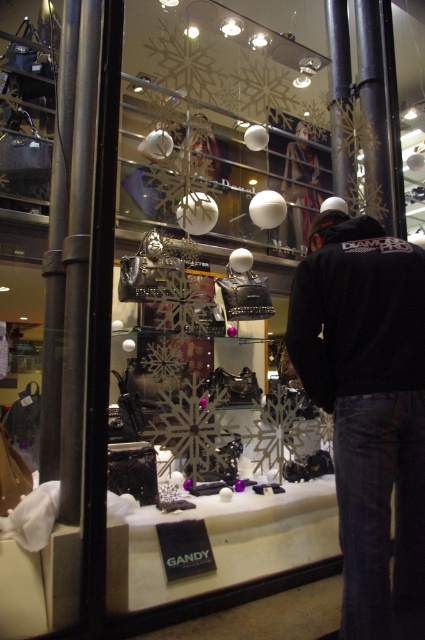
You are a customer trying to decide between the black cotton sweatshirt at center and the matte black jacket at center displayed in the store window. Which one has a shorter length?

The black cotton sweatshirt at center is shorter than the matte black jacket at center.

You are a customer looking to purchase a gift for someone who prefers compact items. You see the black cotton sweatshirt at center and the matte black jacket at center in the display. Which item should you choose based on size?

The black cotton sweatshirt at center is smaller than the matte black jacket at center, so you should choose the black cotton sweatshirt at center for someone who prefers compact items.

You are a customer standing in front of the retail display window. You notice both the black fleece jacket at center and the black cotton sweatshirt at center. Which item is positioned closer to you?

The black fleece jacket at center is closer to the viewer than the black cotton sweatshirt at center.